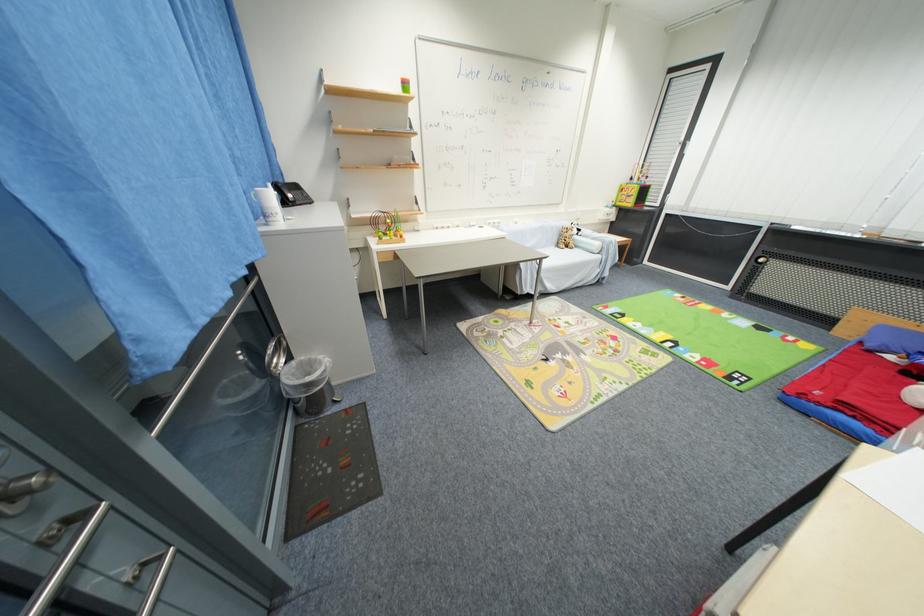
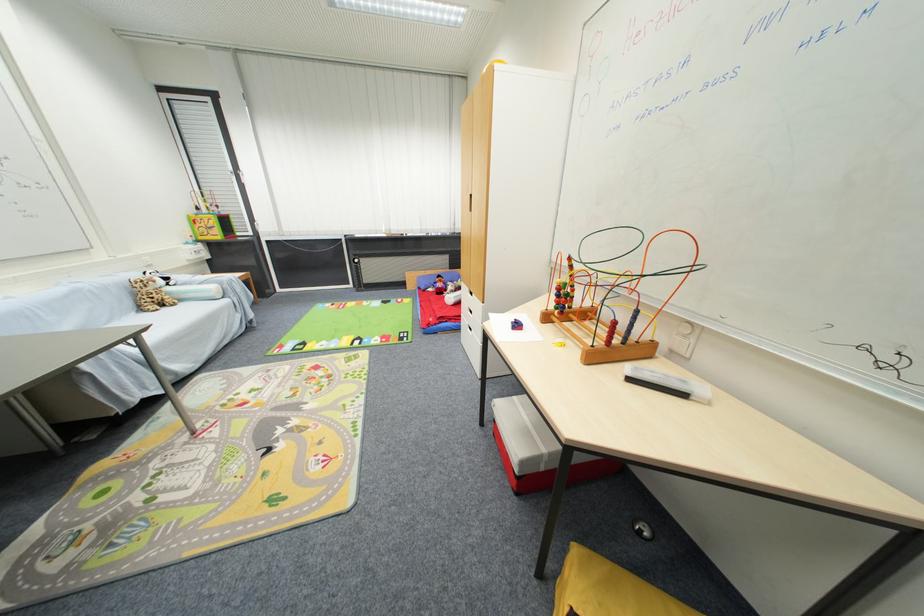
Find the pixel in the second image that matches point (563, 246) in the first image.

(146, 310)